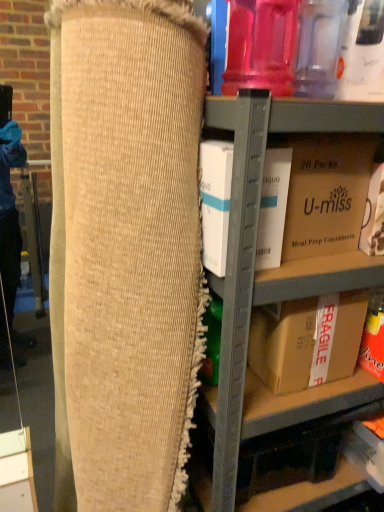
This screenshot has height=512, width=384. What are the coordinates of `brown cardboard box at upper right, which is counted as the first storage box, starting from the top` in the screenshot? It's located at (313, 195).

This screenshot has height=512, width=384. Describe the element at coordinates (256, 236) in the screenshot. I see `cardboard box at center` at that location.

What do you see at coordinates (131, 246) in the screenshot? I see `natural burlap bean bag chair at center` at bounding box center [131, 246].

In order to click on matte cardboard box at lower right, placed as the second storage box when sorted from top to bottom in this screenshot , I will do `click(366, 452)`.

Find the location of `white cardboard box at center, marked as the 2th box in a back-to-front arrangement`. white cardboard box at center, marked as the 2th box in a back-to-front arrangement is located at coordinates (215, 202).

The image size is (384, 512). I want to click on brown cardboard box at upper right, marked as the second storage box in a right-to-left arrangement, so click(313, 195).

Is natural burlap bean bag chair at center not close to brown cardboard box at upper right, marked as the second storage box in a right-to-left arrangement?

That's not correct — natural burlap bean bag chair at center is a little close to brown cardboard box at upper right, marked as the second storage box in a right-to-left arrangement.

Which of these two, natural burlap bean bag chair at center or brown cardboard box at upper right, marked as the 2th storage box in a bottom-to-top arrangement, is smaller?

brown cardboard box at upper right, marked as the 2th storage box in a bottom-to-top arrangement, is smaller.

Can we say natural burlap bean bag chair at center lies outside brown cardboard box at upper right, which is counted as the first storage box, starting from the top?

natural burlap bean bag chair at center lies outside brown cardboard box at upper right, which is counted as the first storage box, starting from the top,'s area.

Locate an element on the screen. Image resolution: width=384 pixels, height=512 pixels. storage box above the natural burlap bean bag chair at center (from a real-world perspective) is located at coordinates (313, 195).

Looking at this image, does matte cardboard box at lower right, positioned as the first storage box in right-to-left order, have a lesser height compared to brown cardboard box at upper right, the first storage box from the left?

Yes.

How many degrees apart are the facing directions of matte cardboard box at lower right, positioned as the first storage box in right-to-left order, and brown cardboard box at upper right, marked as the second storage box in a right-to-left arrangement?

4.99 degrees separate the facing orientations of matte cardboard box at lower right, positioned as the first storage box in right-to-left order, and brown cardboard box at upper right, marked as the second storage box in a right-to-left arrangement.

From a real-world perspective, is matte cardboard box at lower right, which appears as the 1th storage box when ordered from the bottom, above or below brown cardboard box at upper right, which is counted as the first storage box, starting from the top?

In terms of real-world spatial position, matte cardboard box at lower right, which appears as the 1th storage box when ordered from the bottom, is below brown cardboard box at upper right, which is counted as the first storage box, starting from the top.

Is the position of matte cardboard box at lower right, which appears as the 1th storage box when ordered from the bottom, less distant than that of brown cardboard box at upper right, which is counted as the first storage box, starting from the top?

No, matte cardboard box at lower right, which appears as the 1th storage box when ordered from the bottom, is behind brown cardboard box at upper right, which is counted as the first storage box, starting from the top.

Considering the sizes of objects natural burlap bean bag chair at center and cardboard box at center in the image provided, who is smaller, natural burlap bean bag chair at center or cardboard box at center?

natural burlap bean bag chair at center.

Is natural burlap bean bag chair at center facing towards cardboard box at center?

No, natural burlap bean bag chair at center is not facing towards cardboard box at center.

From a real-world perspective, between natural burlap bean bag chair at center and cardboard box at center, who is vertically lower?

cardboard box at center is physically lower.

Which of these two, natural burlap bean bag chair at center or brown cardboard box at lower right, acting as the second box starting from the top, is smaller?

brown cardboard box at lower right, acting as the second box starting from the top, is smaller.

Is natural burlap bean bag chair at center looking in the opposite direction of brown cardboard box at lower right, arranged as the first box when ordered from the bottom?

That's not correct — natural burlap bean bag chair at center is not looking away from brown cardboard box at lower right, arranged as the first box when ordered from the bottom.

From a real-world perspective, is natural burlap bean bag chair at center on brown cardboard box at lower right, acting as the second box starting from the top?

No, from a real-world perspective, natural burlap bean bag chair at center is not on top of brown cardboard box at lower right, acting as the second box starting from the top.

Is brown cardboard box at lower right, marked as the second box in a front-to-back arrangement, inside natural burlap bean bag chair at center?

No, brown cardboard box at lower right, marked as the second box in a front-to-back arrangement, is not surrounded by natural burlap bean bag chair at center.

Is white cardboard box at center, marked as the 2th box in a back-to-front arrangement, next to natural burlap bean bag chair at center?

No, white cardboard box at center, marked as the 2th box in a back-to-front arrangement, is not touching natural burlap bean bag chair at center.

Is white cardboard box at center, the 2th box positioned from the bottom, looking in the opposite direction of natural burlap bean bag chair at center?

No, white cardboard box at center, the 2th box positioned from the bottom, is not facing the opposite direction of natural burlap bean bag chair at center.

Considering the relative sizes of white cardboard box at center, the 2th box positioned from the bottom, and natural burlap bean bag chair at center in the image provided, is white cardboard box at center, the 2th box positioned from the bottom, shorter than natural burlap bean bag chair at center?

Correct, white cardboard box at center, the 2th box positioned from the bottom, is not as tall as natural burlap bean bag chair at center.

Is matte cardboard box at lower right, which is the 2th storage box in left-to-right order, situated inside cardboard box at center or outside?

matte cardboard box at lower right, which is the 2th storage box in left-to-right order, is enclosed within cardboard box at center.

Which is behind, point (357, 438) or point (246, 324)?

The point (357, 438) is farther from the camera.

From the image's perspective, is matte cardboard box at lower right, which is the 2th storage box in left-to-right order, on top of cardboard box at center?

Incorrect, from the image's perspective, matte cardboard box at lower right, which is the 2th storage box in left-to-right order, is lower than cardboard box at center.

Between matte cardboard box at lower right, placed as the second storage box when sorted from top to bottom, and cardboard box at center, which one has larger size?

cardboard box at center.

Looking at this image, considering their positions, is matte cardboard box at lower right, placed as the second storage box when sorted from top to bottom, located in front of or behind natural burlap bean bag chair at center?

matte cardboard box at lower right, placed as the second storage box when sorted from top to bottom, is behind natural burlap bean bag chair at center.

Based on the photo, is matte cardboard box at lower right, positioned as the first storage box in right-to-left order, completely or partially outside of natural burlap bean bag chair at center?

Indeed, matte cardboard box at lower right, positioned as the first storage box in right-to-left order, is completely outside natural burlap bean bag chair at center.

Which object is positioned more to the left, matte cardboard box at lower right, which appears as the 1th storage box when ordered from the bottom, or natural burlap bean bag chair at center?

From the viewer's perspective, natural burlap bean bag chair at center appears more on the left side.

This screenshot has width=384, height=512. Find the location of `bean bag chair below the brown cardboard box at upper right, the first storage box from the left (from the image's perspective)`. bean bag chair below the brown cardboard box at upper right, the first storage box from the left (from the image's perspective) is located at coordinates (131, 246).

Locate an element on the screen. The image size is (384, 512). storage box that is on the right side of brown cardboard box at upper right, which is counted as the first storage box, starting from the top is located at coordinates (366, 452).

From the image, which object appears to be farther from matte cardboard box at lower right, placed as the second storage box when sorted from top to bottom, natural burlap bean bag chair at center or white cardboard box at center, marked as the 2th box in a back-to-front arrangement?

natural burlap bean bag chair at center is positioned further to the anchor matte cardboard box at lower right, placed as the second storage box when sorted from top to bottom.

Estimate the real-world distances between objects in this image. Which object is closer to matte cardboard box at lower right, which appears as the 1th storage box when ordered from the bottom, brown cardboard box at lower right, marked as the second box in a front-to-back arrangement, or brown cardboard box at upper right, the first storage box from the left?

Among the two, brown cardboard box at lower right, marked as the second box in a front-to-back arrangement, is located nearer to matte cardboard box at lower right, which appears as the 1th storage box when ordered from the bottom.

Looking at this image, based on their spatial positions, is brown cardboard box at upper right, the first storage box from the left, or natural burlap bean bag chair at center closer to brown cardboard box at lower right, acting as the second box starting from the top?

brown cardboard box at upper right, the first storage box from the left, lies closer to brown cardboard box at lower right, acting as the second box starting from the top, than the other object.

Which object lies further to the anchor point cardboard box at center, brown cardboard box at lower right, acting as the second box starting from the top, or matte cardboard box at lower right, placed as the second storage box when sorted from top to bottom?

matte cardboard box at lower right, placed as the second storage box when sorted from top to bottom.

When comparing their distances from brown cardboard box at upper right, marked as the second storage box in a right-to-left arrangement, does white cardboard box at center, the 2th box positioned from the bottom, or cardboard box at center seem closer?

white cardboard box at center, the 2th box positioned from the bottom, is positioned closer to the anchor brown cardboard box at upper right, marked as the second storage box in a right-to-left arrangement.

When comparing their distances from matte cardboard box at lower right, which is the 2th storage box in left-to-right order, does cardboard box at center or brown cardboard box at upper right, which is counted as the first storage box, starting from the top, seem further?

The object further to matte cardboard box at lower right, which is the 2th storage box in left-to-right order, is brown cardboard box at upper right, which is counted as the first storage box, starting from the top.

In the scene shown: Based on their spatial positions, is cardboard box at center or brown cardboard box at lower right, arranged as the first box when ordered from the bottom, closer to brown cardboard box at upper right, marked as the 2th storage box in a bottom-to-top arrangement?

cardboard box at center lies closer to brown cardboard box at upper right, marked as the 2th storage box in a bottom-to-top arrangement, than the other object.

From the image, which object appears to be nearer to natural burlap bean bag chair at center, brown cardboard box at lower right, arranged as the first box when ordered from the bottom, or matte cardboard box at lower right, which is the 2th storage box in left-to-right order?

Based on the image, brown cardboard box at lower right, arranged as the first box when ordered from the bottom, appears to be nearer to natural burlap bean bag chair at center.

Locate an element on the screen. Image resolution: width=384 pixels, height=512 pixels. shelf located between natural burlap bean bag chair at center and matte cardboard box at lower right, which appears as the 1th storage box when ordered from the bottom, in the depth direction is located at coordinates (256, 236).

Identify the location of storage box between natural burlap bean bag chair at center and matte cardboard box at lower right, which is the 2th storage box in left-to-right order, from front to back. (313, 195).

Identify the location of box between white cardboard box at center, marked as the 2th box in a back-to-front arrangement, and matte cardboard box at lower right, positioned as the first storage box in right-to-left order, from top to bottom. (307, 340).

In order to click on box between white cardboard box at center, which is the 1th box from front to back, and cardboard box at center in the up-down direction in this screenshot , I will do `click(307, 340)`.